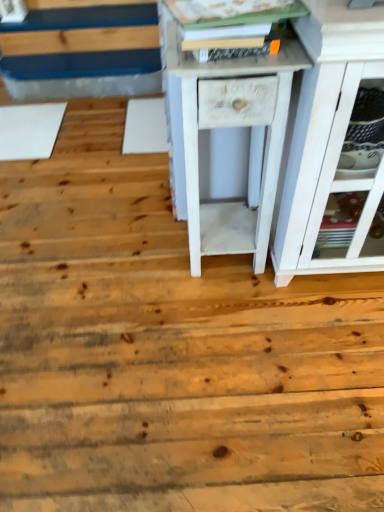
Question: Is white painted wood cabinet at right situated inside white matte nightstand at center or outside?

Choices:
 (A) inside
 (B) outside

Answer: (B)

Question: Looking at the image, does white painted wood cabinet at right seem bigger or smaller compared to white matte nightstand at center?

Choices:
 (A) big
 (B) small

Answer: (A)

Question: From their relative heights in the image, would you say white painted wood cabinet at right is taller or shorter than white matte nightstand at center?

Choices:
 (A) short
 (B) tall

Answer: (B)

Question: Is white matte nightstand at center inside the boundaries of white painted wood cabinet at right, or outside?

Choices:
 (A) inside
 (B) outside

Answer: (B)

Question: Considering the relative positions of white matte nightstand at center and white painted wood cabinet at right in the image provided, is white matte nightstand at center to the left or to the right of white painted wood cabinet at right?

Choices:
 (A) right
 (B) left

Answer: (B)

Question: From a real-world perspective, relative to white painted wood cabinet at right, is white matte nightstand at center vertically above or below?

Choices:
 (A) above
 (B) below

Answer: (B)

Question: From the image's perspective, is white matte nightstand at center located above or below white painted wood cabinet at right?

Choices:
 (A) above
 (B) below

Answer: (B)